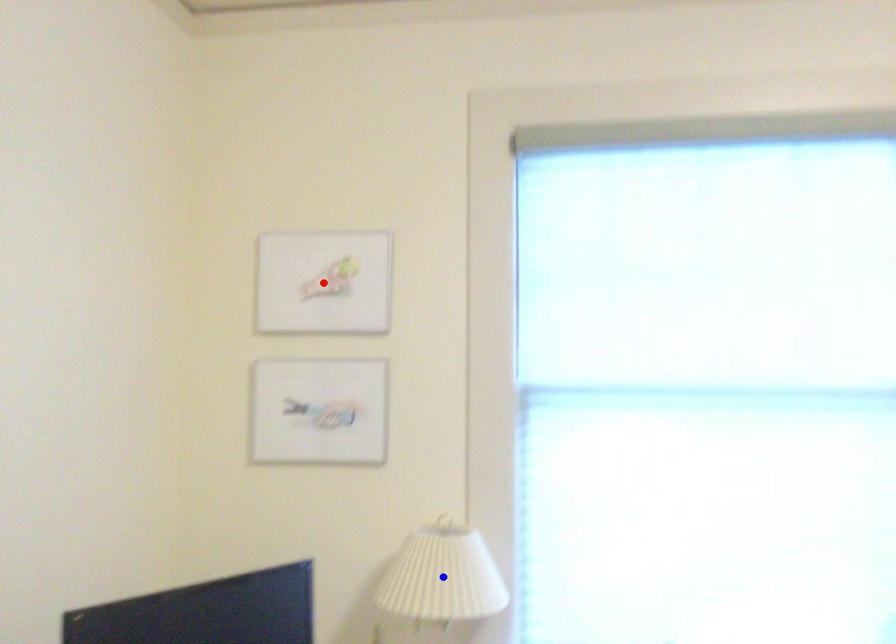
Question: Two points are marked on the image. Which point is closer to the camera?

Choices:
 (A) Blue point is closer.
 (B) Red point is closer.

Answer: (A)